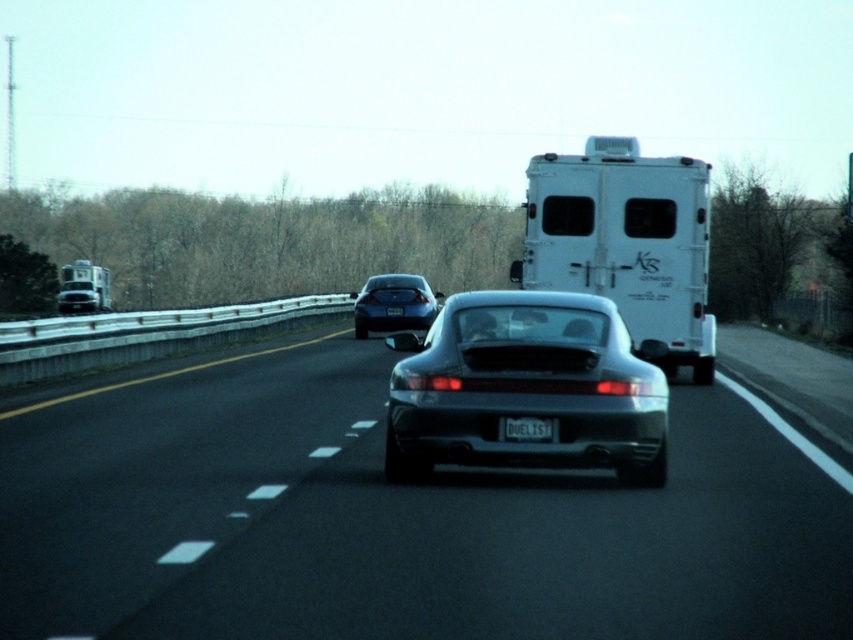
Question: Can you confirm if glossy asphalt road at center is wider than glossy metallic sedan at center?

Choices:
 (A) yes
 (B) no

Answer: (A)

Question: Estimate the real-world distances between objects in this image. Which object is farther from the glossy asphalt road at center?

Choices:
 (A) white plastic license plate at rear
 (B) white matte horse trailer at left
 (C) white matte trailer truck at upper center

Answer: (B)

Question: Can you confirm if glossy asphalt road at center is positioned to the left of black plastic license plate at rear?

Choices:
 (A) no
 (B) yes

Answer: (B)

Question: Which object is the closest to the white matte trailer truck at upper center?

Choices:
 (A) white plastic license plate at rear
 (B) glossy metallic sedan at center
 (C) white matte horse trailer at left

Answer: (A)

Question: Can you confirm if white matte trailer truck at upper center is positioned to the left of black plastic license plate at rear?

Choices:
 (A) yes
 (B) no

Answer: (B)

Question: Which object is positioned closest to the white plastic license plate at rear?

Choices:
 (A) white matte trailer truck at upper center
 (B) black plastic license plate at rear

Answer: (A)